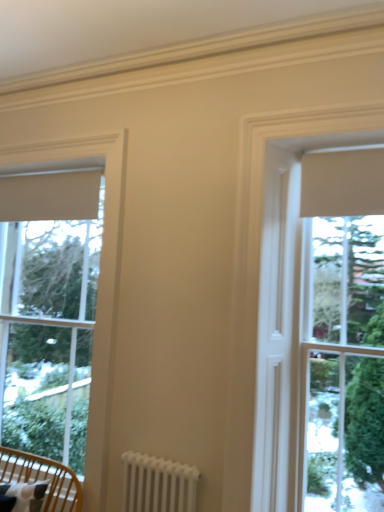
Question: In terms of height, does white metal radiator at lower center look taller or shorter compared to white matte window at center?

Choices:
 (A) short
 (B) tall

Answer: (A)

Question: Is white metal radiator at lower center in front of or behind white matte window at center in the image?

Choices:
 (A) behind
 (B) front

Answer: (A)

Question: Estimate the real-world distances between objects in this image. Which object is closer to the white metal radiator at lower center?

Choices:
 (A) white matte window at center
 (B) white matte window at left
 (C) wooden chair with cushion at lower left

Answer: (C)

Question: Which is nearer to the white matte window at left?

Choices:
 (A) wooden chair with cushion at lower left
 (B) white metal radiator at lower center
 (C) white matte window at center

Answer: (B)